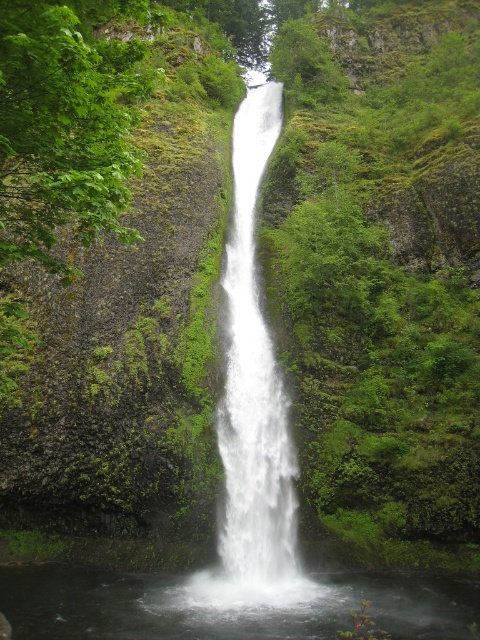
Question: Does clear water at center come in front of white smooth waterfall at center?

Choices:
 (A) yes
 (B) no

Answer: (A)

Question: Which point is closer to the camera taking this photo?

Choices:
 (A) (250, 154)
 (B) (228, 624)

Answer: (B)

Question: Is clear water at center bigger than white smooth waterfall at center?

Choices:
 (A) yes
 (B) no

Answer: (B)

Question: Is clear water at center to the right of white smooth waterfall at center from the viewer's perspective?

Choices:
 (A) no
 (B) yes

Answer: (A)